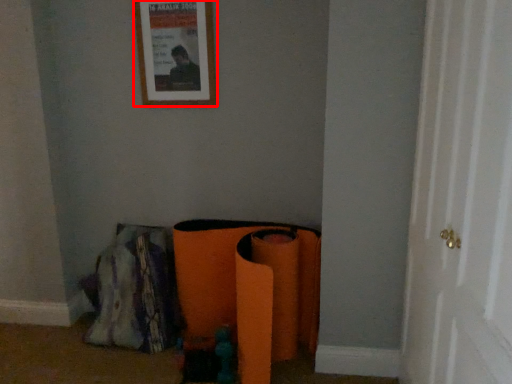
Question: Considering the relative positions of picture frame (annotated by the red box) and door in the image provided, where is picture frame (annotated by the red box) located with respect to the staircase?

Choices:
 (A) left
 (B) right

Answer: (A)